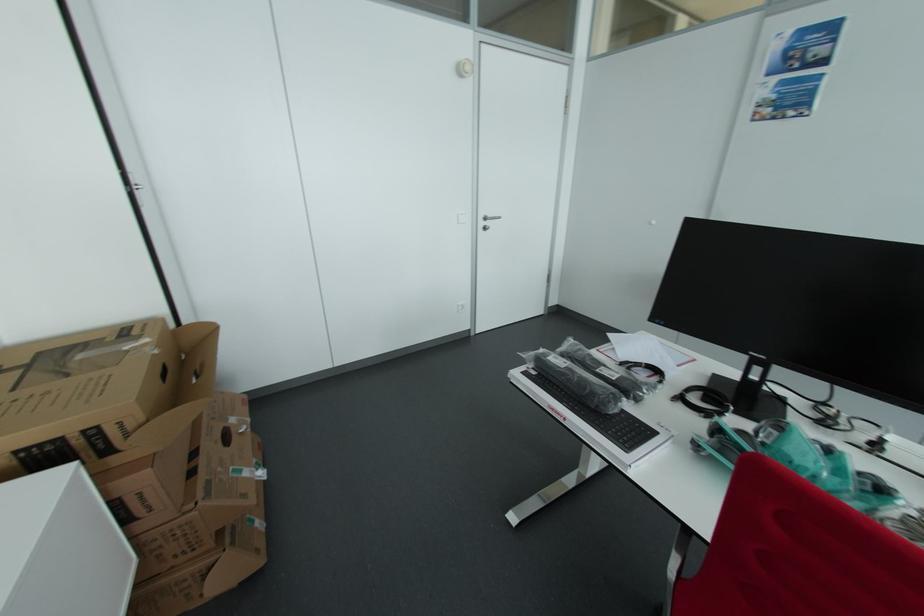
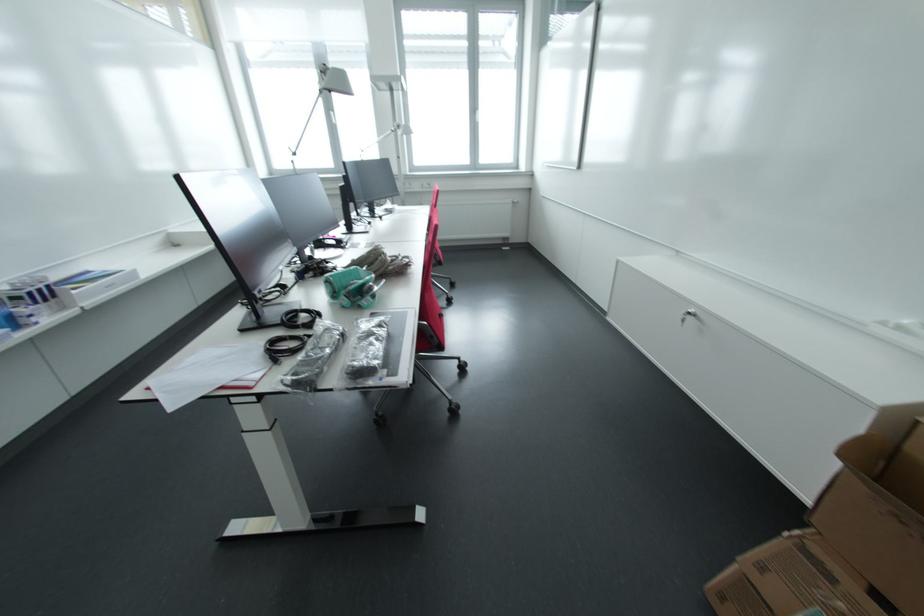
Find the pixel in the second image that matches [211,485] in the first image.

(833, 578)